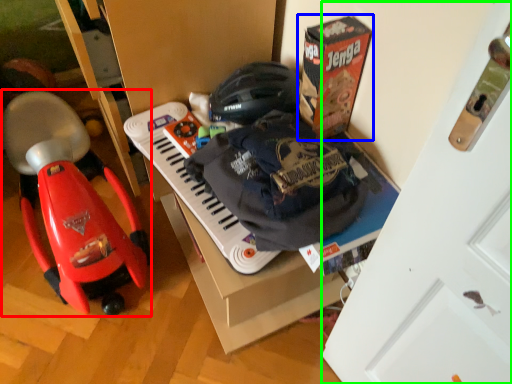
Question: Considering the real-world distances, which object is farthest from baby carriage (highlighted by a red box)? box (highlighted by a blue box) or door (highlighted by a green box)?

Choices:
 (A) box
 (B) door

Answer: (B)